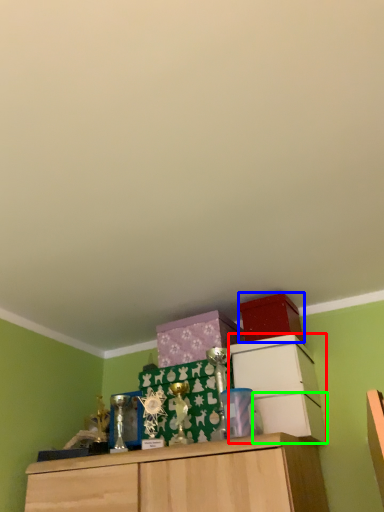
Question: Based on their relative distances, which object is nearer to cabinetry (highlighted by a red box)? Choose from storage box (highlighted by a blue box) and drawer (highlighted by a green box).

Choices:
 (A) storage box
 (B) drawer

Answer: (B)